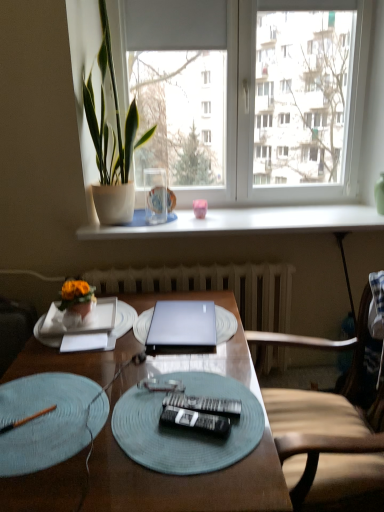
Find the location of a particular element. empty space that is in between black plastic remote control at center, marked as the second remote control in a back-to-front arrangement, and white paper at center is located at coordinates (129, 377).